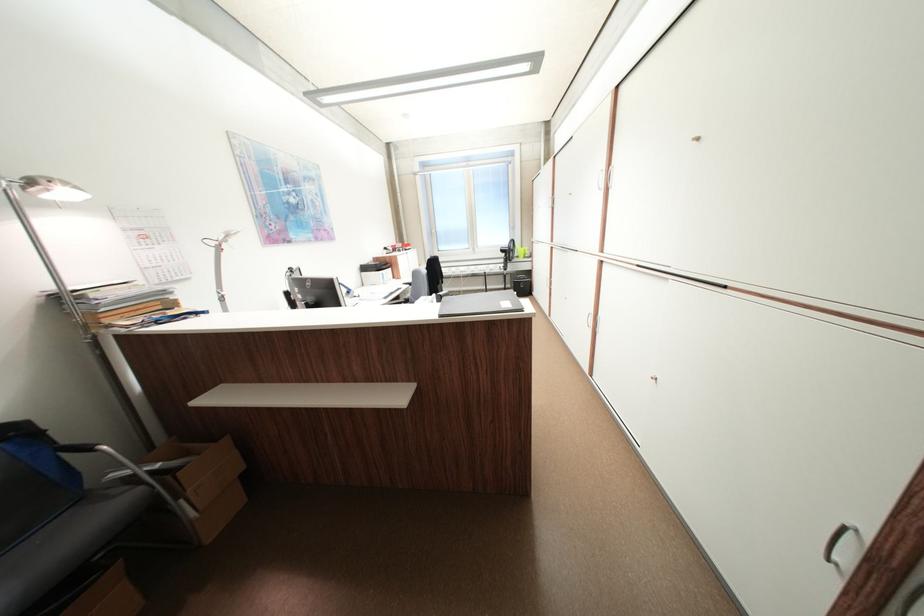
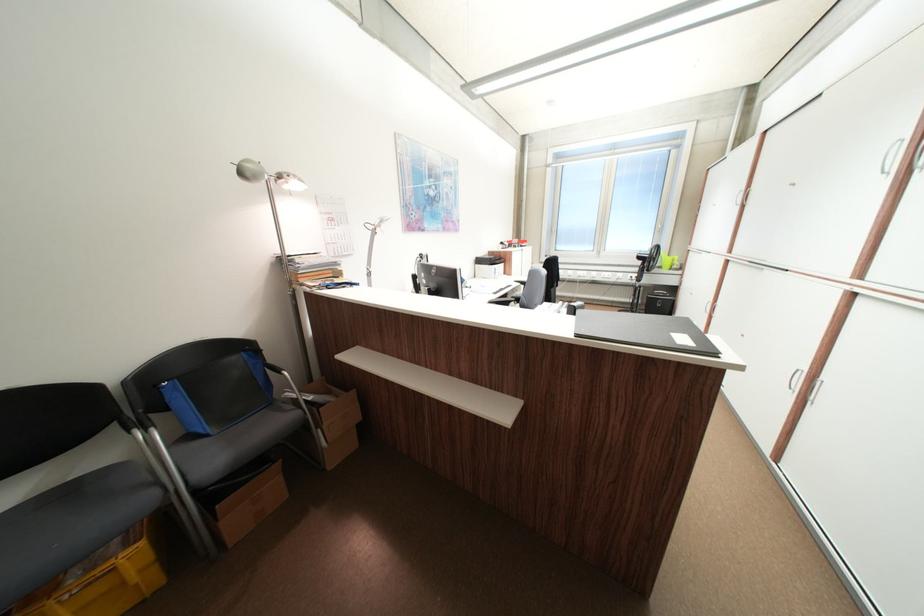
Question: The first image is from the beginning of the video and the second image is from the end. How did the camera likely rotate when shooting the video?

Choices:
 (A) Left
 (B) Right
 (C) Up
 (D) Down

Answer: (A)